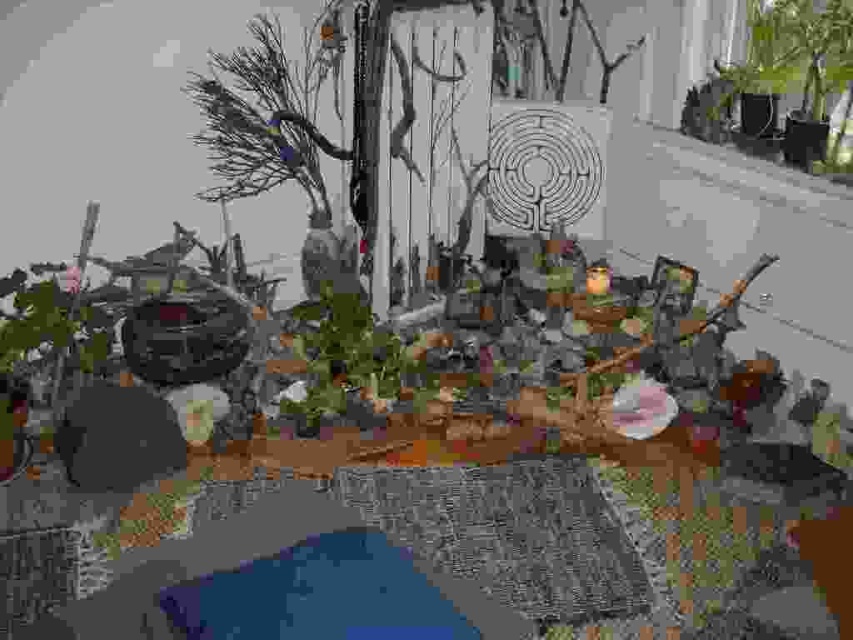
Question: Which point is farther from the camera taking this photo?

Choices:
 (A) (262, 22)
 (B) (820, 211)

Answer: (A)

Question: Which point is farther to the camera?

Choices:
 (A) click(x=357, y=394)
 (B) click(x=199, y=112)
 (C) click(x=654, y=131)

Answer: (C)

Question: Is the position of green leafy plant at center more distant than that of white concrete window sill at upper right?

Choices:
 (A) yes
 (B) no

Answer: (B)

Question: Which point appears closest to the camera in this image?

Choices:
 (A) (792, 10)
 (B) (697, 152)

Answer: (A)

Question: Can you confirm if green leafy plant at center is positioned to the left of green matte plant at upper right?

Choices:
 (A) no
 (B) yes

Answer: (B)

Question: Observing the image, what is the correct spatial positioning of brown matte branch at upper left in reference to green leafy plant at center?

Choices:
 (A) left
 (B) right

Answer: (A)